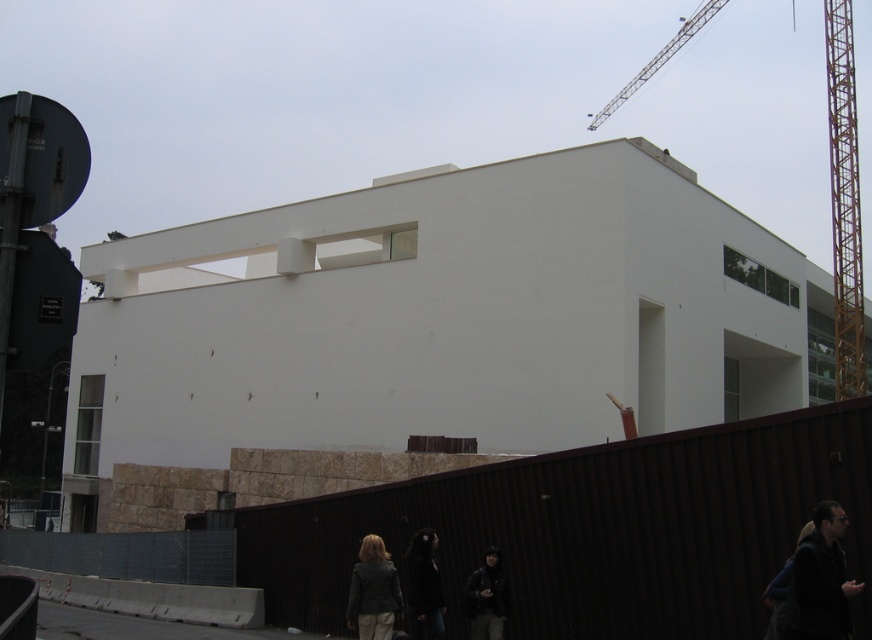
Question: Does brown corrugated metal fence at lower center appear on the left side of dark matte coat at lower center?

Choices:
 (A) no
 (B) yes

Answer: (B)

Question: Does dark gray jacket at lower right appear on the left side of matte gray jacket at lower center?

Choices:
 (A) no
 (B) yes

Answer: (A)

Question: Does dark gray jacket at lower right have a greater width compared to matte gray jacket at lower center?

Choices:
 (A) no
 (B) yes

Answer: (B)

Question: Which is nearer to the matte gray jacket at lower center?

Choices:
 (A) white smooth building at center
 (B) yellow metal crane at upper right
 (C) dark matte coat at lower center

Answer: (C)

Question: Which point is closer to the camera?

Choices:
 (A) brown corrugated metal fence at lower center
 (B) dark matte coat at lower center
 (C) dark gray jacket at lower right

Answer: (C)

Question: Among these objects, which one is nearest to the camera?

Choices:
 (A) brown corrugated metal fence at lower center
 (B) white smooth building at center

Answer: (A)